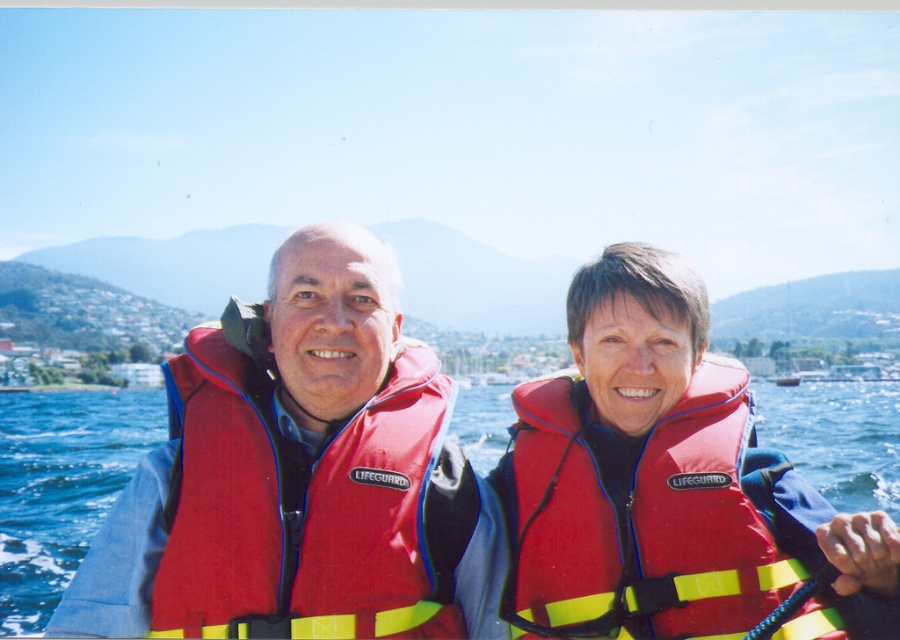
Question: Estimate the real-world distances between objects in this image. Which object is farther from the red life vest at center?

Choices:
 (A) red fabric life jacket at center
 (B) red/yellow fabric life jacket at center

Answer: (B)

Question: Does red life vest at center have a smaller size compared to red fabric life jacket at center?

Choices:
 (A) no
 (B) yes

Answer: (A)

Question: Which of the following is the closest to the observer?

Choices:
 (A) red/yellow fabric life jacket at center
 (B) red fabric life jacket at center
 (C) red life vest at center

Answer: (A)

Question: Can you confirm if red life vest at center is positioned below red/yellow fabric life jacket at center?

Choices:
 (A) no
 (B) yes

Answer: (A)

Question: Is red fabric life jacket at center below red/yellow fabric life jacket at center?

Choices:
 (A) no
 (B) yes

Answer: (A)

Question: Among these objects, which one is nearest to the camera?

Choices:
 (A) red fabric life jacket at center
 (B) red/yellow fabric life jacket at center

Answer: (B)